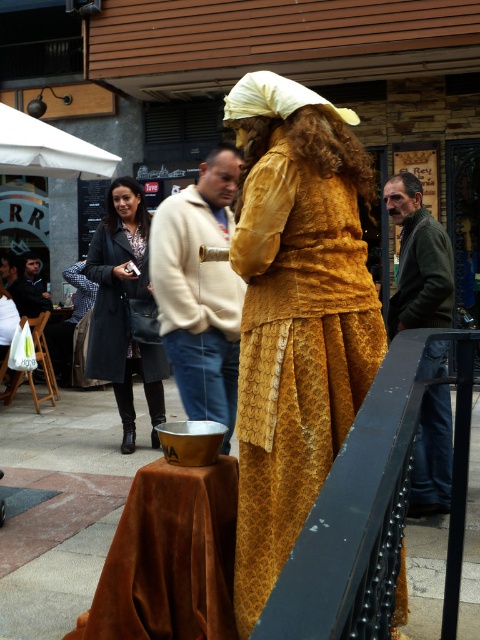
Does golden textured fabric dress at center come in front of dark green jacket at right?

Yes, it is in front of dark green jacket at right.

Does golden textured fabric dress at center appear on the right side of dark green jacket at right?

In fact, golden textured fabric dress at center is to the left of dark green jacket at right.

The height and width of the screenshot is (640, 480). In order to click on golden textured fabric dress at center in this screenshot , I will do `click(295, 353)`.

In the scene shown: Can you confirm if dark green jacket at right is positioned to the left of dark gray coat at center?

In fact, dark green jacket at right is to the right of dark gray coat at center.

Who is more distant from viewer, (446, 396) or (116, 326)?

The point (116, 326) is behind.

At what (x,y) coordinates should I click in order to perform the action: click on dark green jacket at right. Please return your answer as a coordinate pair (x, y). Looking at the image, I should click on (419, 260).

Who is more distant from viewer, (189, 196) or (155, 435)?

The point (155, 435) is more distant.

Locate an element on the screen. The height and width of the screenshot is (640, 480). beige sweater at center is located at coordinates (200, 291).

The width and height of the screenshot is (480, 640). In order to click on beige sweater at center in this screenshot , I will do `click(200, 291)`.